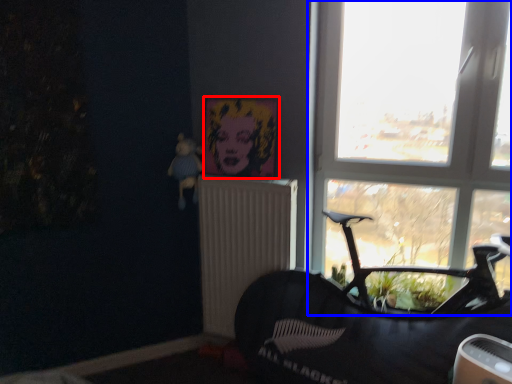
Question: Among these objects, which one is nearest to the camera, picture frame (highlighted by a red box) or window (highlighted by a blue box)?

Choices:
 (A) picture frame
 (B) window

Answer: (B)